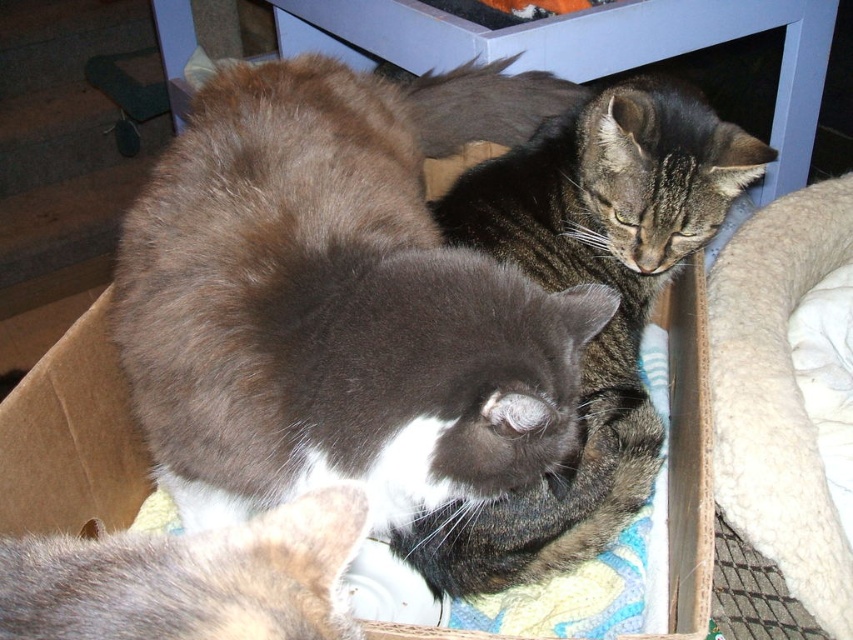
In the scene shown: You are a cat owner who wants to ensure both cats have enough space in the cardboard box. Given that the gray fur cat at center is larger, does the gray soft fur at lower left have enough space to move comfortably?

The gray fur cat at center is bigger than the gray soft fur at lower left, so there should be enough space for the smaller cat to move comfortably.

Consider the image. You are a cat owner who wants to place a small toy exactly at the center of the cardboard box where the gray fur cat at center is located. According to the image, is the point at coordinates point (340, 298) the correct spot for the toy?

Yes, the point at coordinates point (340, 298) is the correct spot because the gray fur cat at center is located exactly there.

You are taking a photo of two cats in a cardboard box. The box has two points marked as point A at coordinates point A is point (297, 236) and point B at coordinates point B is point (846, 614). Which point will appear closer to the camera in the photo?

Point A at coordinates point A is point (297, 236) is closer to the camera than point B at coordinates point B is point (846, 614).